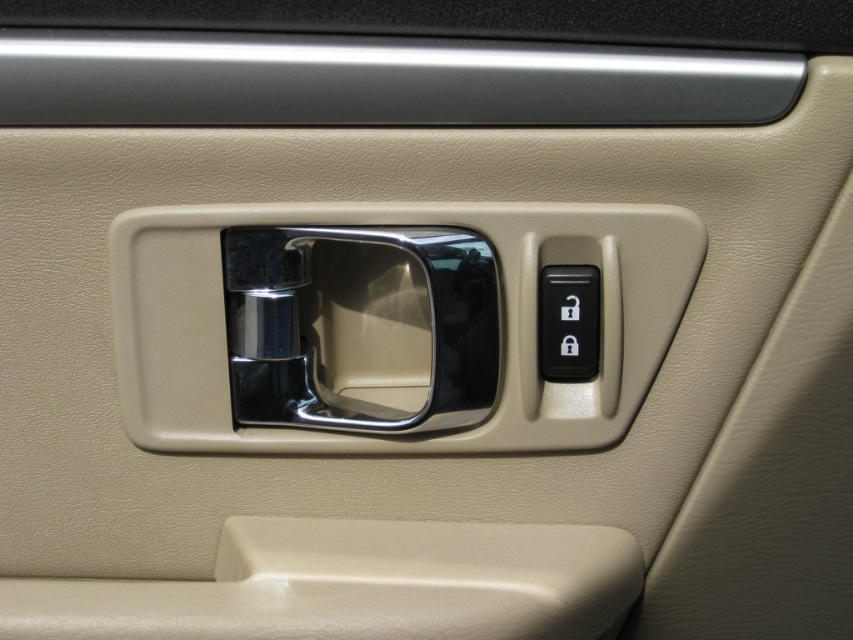
Question: Can you confirm if chrome/metallic door handle at center is thinner than black rubber lock at center right?

Choices:
 (A) yes
 (B) no

Answer: (B)

Question: Which point appears farthest from the camera in this image?

Choices:
 (A) (564, 324)
 (B) (229, 328)

Answer: (B)

Question: Which point is closer to the camera?

Choices:
 (A) (567, 280)
 (B) (410, 428)

Answer: (A)

Question: Is chrome/metallic door handle at center further to the viewer compared to black rubber lock at center right?

Choices:
 (A) yes
 (B) no

Answer: (B)

Question: Can you confirm if chrome/metallic door handle at center is bigger than black rubber lock at center right?

Choices:
 (A) yes
 (B) no

Answer: (A)